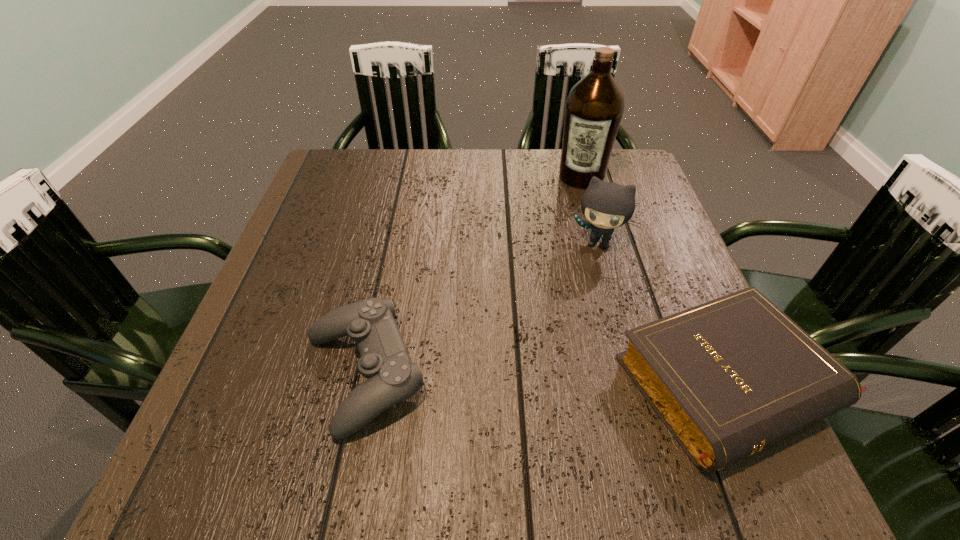
Where is `kitten that is positioned at the right edge`? The height and width of the screenshot is (540, 960). kitten that is positioned at the right edge is located at coordinates click(606, 205).

In order to click on object present at the near left corner in this screenshot , I will do `click(391, 376)`.

Where is `object located at the far right corner`? object located at the far right corner is located at coordinates (594, 108).

Locate an element on the screen. This screenshot has width=960, height=540. object at the near right corner is located at coordinates 729,377.

The height and width of the screenshot is (540, 960). I want to click on free space at the far edge of the desktop, so click(x=551, y=174).

In the image, there is a desktop. Identify the location of vacant space at the left edge. (287, 298).

Where is `free location at the right edge`? The image size is (960, 540). free location at the right edge is located at coordinates pyautogui.click(x=693, y=292).

Locate an element on the screen. The image size is (960, 540). vacant space at the far left corner is located at coordinates (x=376, y=153).

The width and height of the screenshot is (960, 540). Identify the location of free space at the far right corner. (626, 171).

Identify the location of blank region between the control and the tallest object. (472, 275).